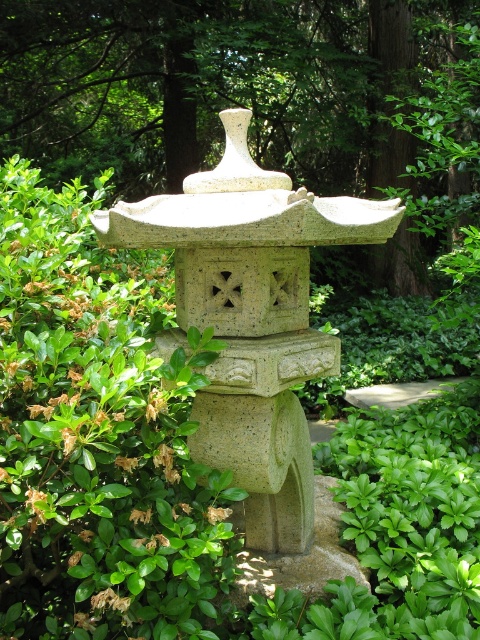
Question: Is green leafy bush at center to the right of gray stone statue at center from the viewer's perspective?

Choices:
 (A) no
 (B) yes

Answer: (A)

Question: Considering the relative positions of green leafy bush at center and gray stone statue at center in the image provided, where is green leafy bush at center located with respect to gray stone statue at center?

Choices:
 (A) left
 (B) right

Answer: (A)

Question: Does green leafy bush at center appear under gray stone statue at center?

Choices:
 (A) no
 (B) yes

Answer: (B)

Question: Which point is farther from the camera taking this photo?

Choices:
 (A) (182, 465)
 (B) (373, 77)

Answer: (B)

Question: Which point is farther to the camera?

Choices:
 (A) (168, 12)
 (B) (140, 316)

Answer: (A)